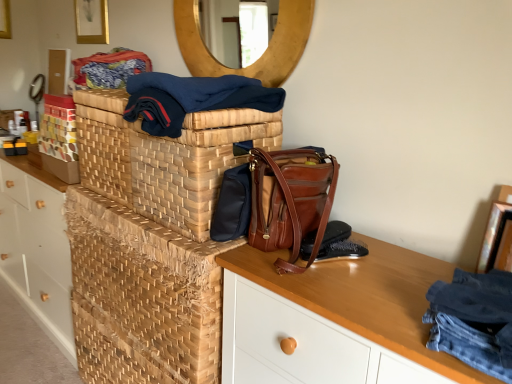
Locate an element on the screen. The height and width of the screenshot is (384, 512). free location to the right of brown leather shoe at center, the second shoe in the top-to-bottom sequence is located at coordinates (392, 266).